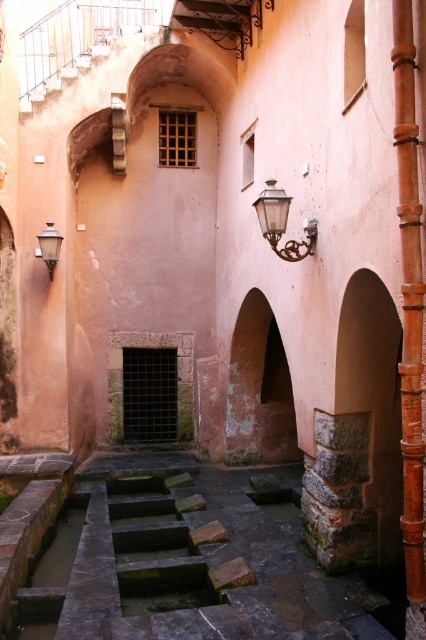
Between dark stone troughs at center and smooth reddish-brown pipe at right, which one has more height?

With more height is smooth reddish-brown pipe at right.

Locate an element on the screen. Image resolution: width=426 pixels, height=640 pixels. dark stone troughs at center is located at coordinates (183, 560).

Is smooth pink stone archway at center further to camera compared to matte white wall-mounted light fixture at upper left?

No, it is not.

Does smooth pink stone archway at center have a greater height compared to matte white wall-mounted light fixture at upper left?

Correct, smooth pink stone archway at center is much taller as matte white wall-mounted light fixture at upper left.

The height and width of the screenshot is (640, 426). I want to click on smooth pink stone archway at center, so click(x=259, y=388).

The width and height of the screenshot is (426, 640). What do you see at coordinates (183, 560) in the screenshot? I see `dark stone troughs at center` at bounding box center [183, 560].

Is dark stone troughs at center behind smooth pink stone archway at center?

No, dark stone troughs at center is in front of smooth pink stone archway at center.

The height and width of the screenshot is (640, 426). Describe the element at coordinates (183, 560) in the screenshot. I see `dark stone troughs at center` at that location.

Identify the location of dark stone troughs at center. Image resolution: width=426 pixels, height=640 pixels. (183, 560).